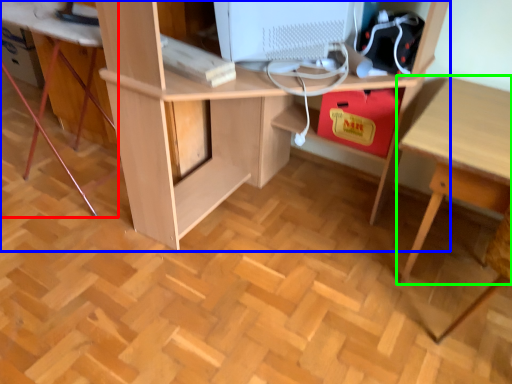
Question: Based on their relative distances, which object is nearer to computer desk (highlighted by a red box)? Choose from desk (highlighted by a blue box) and table (highlighted by a green box).

Choices:
 (A) desk
 (B) table

Answer: (A)